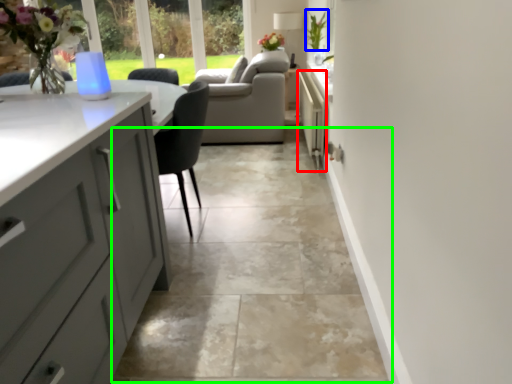
Question: Based on their relative distances, which object is nearer to appliance (highlighted by a red box)? Choose from plant (highlighted by a blue box) and path (highlighted by a green box).

Choices:
 (A) plant
 (B) path

Answer: (A)